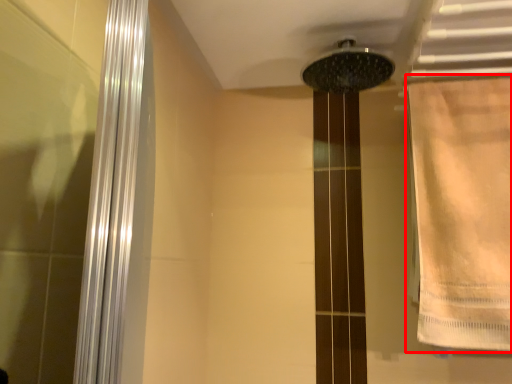
Question: Considering the relative positions of shower curtain (annotated by the red box) and shower in the image provided, where is shower curtain (annotated by the red box) located with respect to the staircase?

Choices:
 (A) right
 (B) left

Answer: (A)